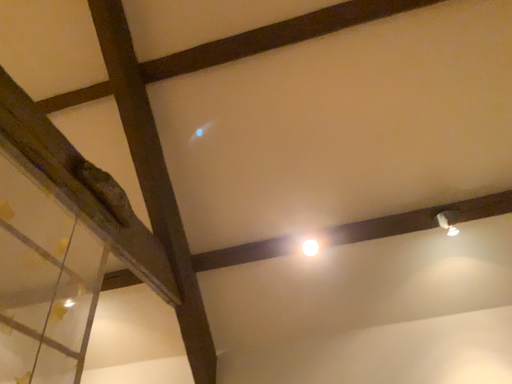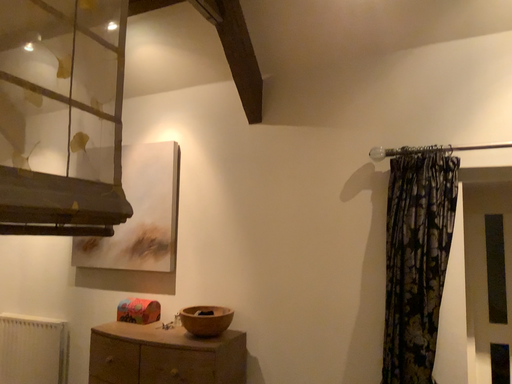
Question: How did the camera likely rotate when shooting the video?

Choices:
 (A) rotated right
 (B) rotated left

Answer: (B)